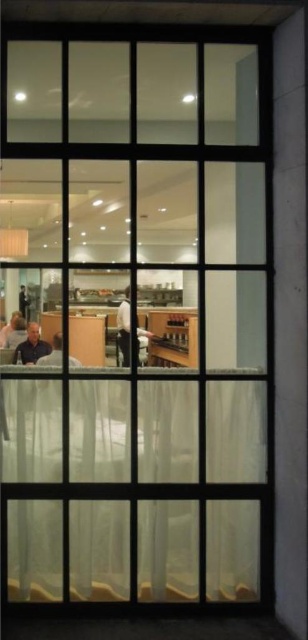
Does point (146, 333) come farther from viewer compared to point (36, 356)?

Yes, point (146, 333) is behind point (36, 356).

Does dark gray fabric jacket at center appear on the left side of matte black shirt at lower left?

In fact, dark gray fabric jacket at center is to the right of matte black shirt at lower left.

What do you see at coordinates (124, 326) in the screenshot?
I see `dark gray fabric jacket at center` at bounding box center [124, 326].

Where is `dark gray fabric jacket at center`? dark gray fabric jacket at center is located at coordinates (124, 326).

Does dark gray fabric jacket at center come behind matte black laptop at lower left?

Yes.

Which is more to the left, dark gray fabric jacket at center or matte black laptop at lower left?

matte black laptop at lower left is more to the left.

Between point (129, 333) and point (60, 356), which one is positioned in front?

Point (60, 356)

Where is `dark gray fabric jacket at center`? dark gray fabric jacket at center is located at coordinates (124, 326).

Is point (247, 579) farther from camera compared to point (126, 337)?

No, (247, 579) is in front of (126, 337).

Between point (222, 531) and point (122, 316), which one is positioned behind?

Point (222, 531)

At what (x,y) coordinates should I click in order to perform the action: click on translucent fabric curtain at lower center. Please return your answer as a coordinate pair (x, y). Image resolution: width=308 pixels, height=640 pixels. Looking at the image, I should click on (134, 488).